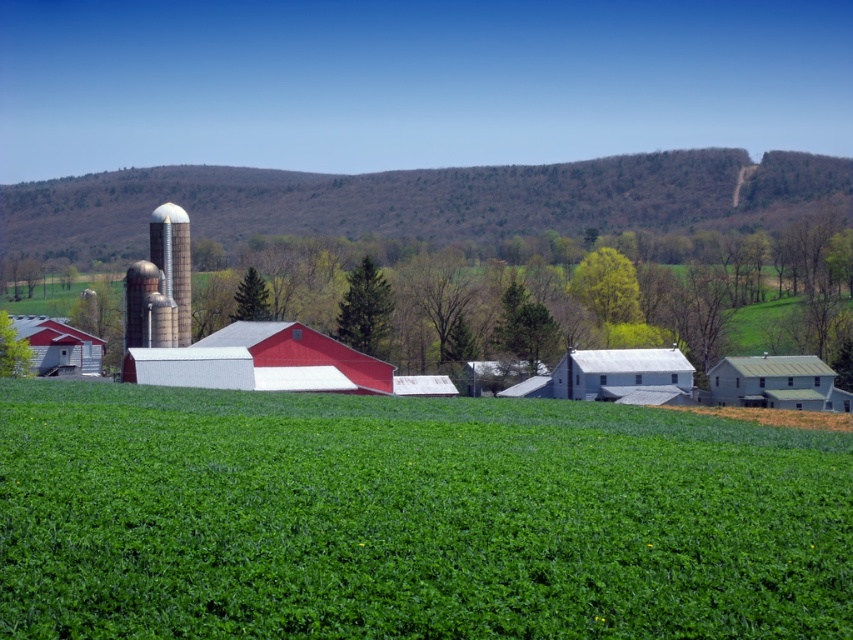
Question: Which object is positioned farthest from the matte red barn at left?

Choices:
 (A) green metal barn at right
 (B) silvery metallic silo at center-left
 (C) green textured hillside at upper center
 (D) white matte barn at center

Answer: (C)

Question: Can you confirm if green metal barn at right is thinner than matte red barn at left?

Choices:
 (A) yes
 (B) no

Answer: (A)

Question: Which point is closer to the camera taking this photo?

Choices:
 (A) (62, 353)
 (B) (556, 376)

Answer: (B)

Question: Is green grassy field at center bigger than green metal barn at right?

Choices:
 (A) no
 (B) yes

Answer: (B)

Question: Considering the real-world distances, which object is closest to the matte red barn at left?

Choices:
 (A) matte white barn at center
 (B) green grassy field at center

Answer: (A)

Question: Is green grassy field at center smaller than matte red barn at left?

Choices:
 (A) yes
 (B) no

Answer: (A)